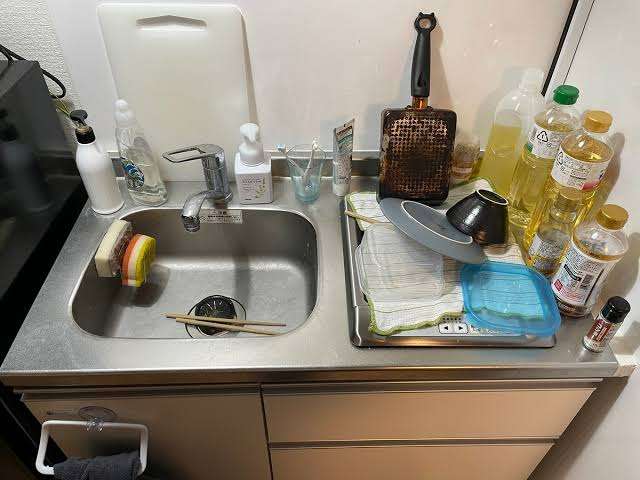
Find the location of a particular element. The width and height of the screenshot is (640, 480). soap can is located at coordinates (121, 149).